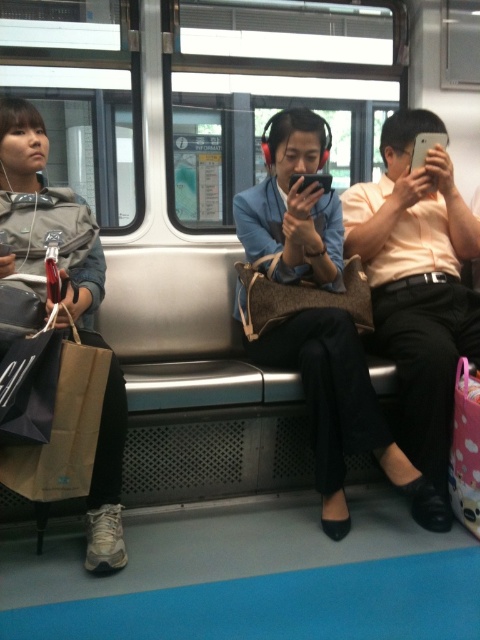
Does point (405, 310) come farther from viewer compared to point (29, 177)?

Yes, it is.

Who is more forward, (427,209) or (119,429)?

Point (119,429) is in front.

Is point (386, 134) closer to viewer compared to point (107, 477)?

No.

Image resolution: width=480 pixels, height=640 pixels. What are the coordinates of `matte orange shirt at center` in the screenshot? It's located at (418, 284).

This screenshot has width=480, height=640. What do you see at coordinates (343, 412) in the screenshot?
I see `matte black pants at center` at bounding box center [343, 412].

Is point (351, 403) in front of point (14, 132)?

Yes, it is.

Does point (257, 196) come behind point (88, 296)?

Yes.

Find the location of a particular element. matte black pants at center is located at coordinates (343, 412).

Is matte black pants at center thinner than matte orange shirt at center?

No, matte black pants at center is not thinner than matte orange shirt at center.

Does matte black pants at center have a larger size compared to matte orange shirt at center?

Indeed, matte black pants at center has a larger size compared to matte orange shirt at center.

Image resolution: width=480 pixels, height=640 pixels. I want to click on matte black pants at center, so click(x=343, y=412).